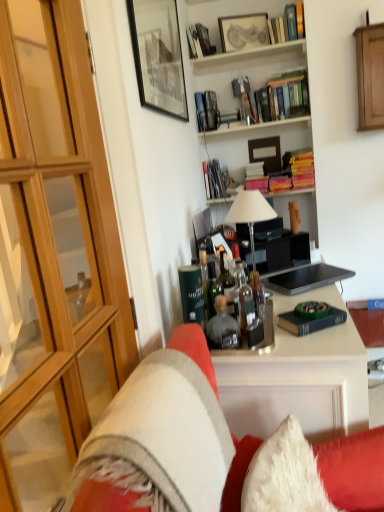
Question: Considering the relative positions of metallic silver book at upper center, which appears as the second book when viewed from the back, and translucent glass bottles at center, the 1th bottle from the right, in the image provided, is metallic silver book at upper center, which appears as the second book when viewed from the back, to the left or to the right of translucent glass bottles at center, the 1th bottle from the right,?

Choices:
 (A) right
 (B) left

Answer: (B)

Question: From the image's perspective, is metallic silver book at upper center, the 4th book positioned from the top, positioned above or below translucent glass bottles at center, the 2th bottle positioned from the left?

Choices:
 (A) below
 (B) above

Answer: (B)

Question: Estimate the real-world distances between objects in this image. Which object is farther from the translucent glass bottles at center, the 1th bottle from the right?

Choices:
 (A) velvet-like beige couch at center
 (B) matte black picture frame at upper center, positioned as the second picture frame in front-to-back order
 (C) hardcover books at upper center, which is counted as the second shelf, starting from the bottom
 (D) wooden cabinet at upper right, which is the 2th cabinetry from front to back
 (E) white glass table lamp at center

Answer: (B)

Question: Which of these objects is positioned farthest from the black matte laptop at center?

Choices:
 (A) hardcover book at upper center, the 5th book viewed from the front
 (B) wooden bookshelf at upper center, the 3th shelf from the bottom
 (C) hardcover book at center, the second book positioned from the bottom
 (D) hardcover books at upper center, the 4th book when ordered from back to front
 (E) wooden cabinet at upper right, positioned as the second cabinetry in left-to-right order

Answer: (A)